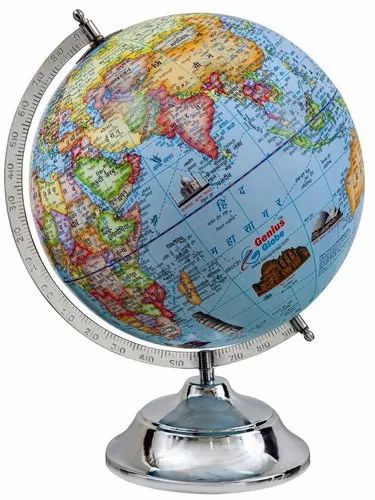
I want to click on the bottom knob, so click(x=307, y=337).